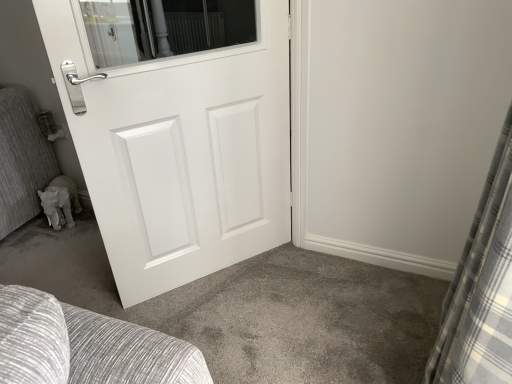
Describe the element at coordinates (176, 134) in the screenshot. This screenshot has width=512, height=384. I see `white matte door at center` at that location.

Identify the location of white matte door at center. This screenshot has height=384, width=512. (176, 134).

Identify the location of gray plaid curtain at right. The height and width of the screenshot is (384, 512). (481, 288).

Describe the element at coordinates (481, 288) in the screenshot. Image resolution: width=512 pixels, height=384 pixels. I see `gray plaid curtain at right` at that location.

Identify the location of white matte door at center. (176, 134).

Which object is positioned more to the right, white matte door at center or gray plaid curtain at right?

gray plaid curtain at right is more to the right.

Is white matte door at center further to camera compared to gray plaid curtain at right?

Yes, the depth of white matte door at center is greater than that of gray plaid curtain at right.

Does point (101, 186) come farther from viewer compared to point (466, 295)?

Yes, it is.

From the image's perspective, relative to gray plaid curtain at right, is white matte door at center above or below?

Clearly, from the image's perspective, white matte door at center is above gray plaid curtain at right.

In the scene shown: From a real-world perspective, between white matte door at center and gray plaid curtain at right, who is vertically lower?

white matte door at center, from a real-world perspective.

From the picture: Does white matte door at center have a greater width compared to gray plaid curtain at right?

Incorrect, the width of white matte door at center does not surpass that of gray plaid curtain at right.

Looking at this image, can you confirm if white matte door at center is shorter than gray plaid curtain at right?

Yes, white matte door at center is shorter than gray plaid curtain at right.

Which of these two, white matte door at center or gray plaid curtain at right, is smaller?

white matte door at center is smaller.

Choose the correct answer: Is white matte door at center inside gray plaid curtain at right or outside it?

white matte door at center is spatially situated outside gray plaid curtain at right.

Is white matte door at center next to gray plaid curtain at right?

No, white matte door at center is not with gray plaid curtain at right.

Is white matte door at center facing towards gray plaid curtain at right?

No.

Find the location of `door above the gray plaid curtain at right (from the image's perspective)`. door above the gray plaid curtain at right (from the image's perspective) is located at coordinates (176, 134).

Is gray plaid curtain at right at the right side of white matte door at center?

Correct, you'll find gray plaid curtain at right to the right of white matte door at center.

Is gray plaid curtain at right closer to the viewer compared to white matte door at center?

Yes, it is.

Does point (471, 272) lie behind point (175, 43)?

No, it is in front of (175, 43).

From the image's perspective, which one is positioned higher, gray plaid curtain at right or white matte door at center?

white matte door at center.

From a real-world perspective, is gray plaid curtain at right located higher than white matte door at center?

Correct, in the physical world, gray plaid curtain at right is higher than white matte door at center.

Considering the sizes of objects gray plaid curtain at right and white matte door at center in the image provided, who is wider, gray plaid curtain at right or white matte door at center?

Wider between the two is gray plaid curtain at right.

Which of these two, gray plaid curtain at right or white matte door at center, stands shorter?

white matte door at center is shorter.

Based on their sizes in the image, would you say gray plaid curtain at right is bigger or smaller than white matte door at center?

In the image, gray plaid curtain at right appears to be larger than white matte door at center.

Is gray plaid curtain at right not inside white matte door at center?

Yes, gray plaid curtain at right is located beyond the bounds of white matte door at center.

Is gray plaid curtain at right far from white matte door at center?

Indeed, gray plaid curtain at right is not near white matte door at center.

Is gray plaid curtain at right aimed at white matte door at center?

Yes, gray plaid curtain at right faces towards white matte door at center.

What's the angular difference between gray plaid curtain at right and white matte door at center's facing directions?

gray plaid curtain at right and white matte door at center are facing 35.5 degrees away from each other.

You are a GUI agent. You are given a task and a screenshot of the screen. Output one action in this format:
    pyautogui.click(x=<x>, y=<y>)
    Task: Click on the door that is above the gray plaid curtain at right (from the image's perspective)
    This screenshot has width=512, height=384.
    Given the screenshot: What is the action you would take?
    pyautogui.click(x=176, y=134)

What are the coordinates of `curtain above the white matte door at center (from a real-world perspective)` in the screenshot? It's located at (481, 288).

Where is `curtain that is below the white matte door at center (from the image's perspective)`? The height and width of the screenshot is (384, 512). curtain that is below the white matte door at center (from the image's perspective) is located at coordinates (481, 288).